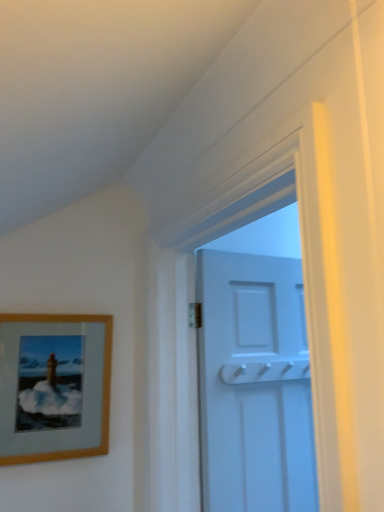
Question: Looking at their shapes, would you say wooden picture frame at left is wider or thinner than white matte door at upper center?

Choices:
 (A) thin
 (B) wide

Answer: (A)

Question: In the image, is wooden picture frame at left on the left side or the right side of white matte door at upper center?

Choices:
 (A) right
 (B) left

Answer: (B)

Question: From a real-world perspective, relative to white matte door at upper center, is wooden picture frame at left vertically above or below?

Choices:
 (A) above
 (B) below

Answer: (A)

Question: In terms of width, does white matte door at upper center look wider or thinner when compared to wooden picture frame at left?

Choices:
 (A) thin
 (B) wide

Answer: (B)

Question: Which is correct: white matte door at upper center is inside wooden picture frame at left, or outside of it?

Choices:
 (A) inside
 (B) outside

Answer: (B)

Question: Considering the positions of white matte door at upper center and wooden picture frame at left in the image, is white matte door at upper center taller or shorter than wooden picture frame at left?

Choices:
 (A) short
 (B) tall

Answer: (B)

Question: From a real-world perspective, is white matte door at upper center physically located above or below wooden picture frame at left?

Choices:
 (A) above
 (B) below

Answer: (B)